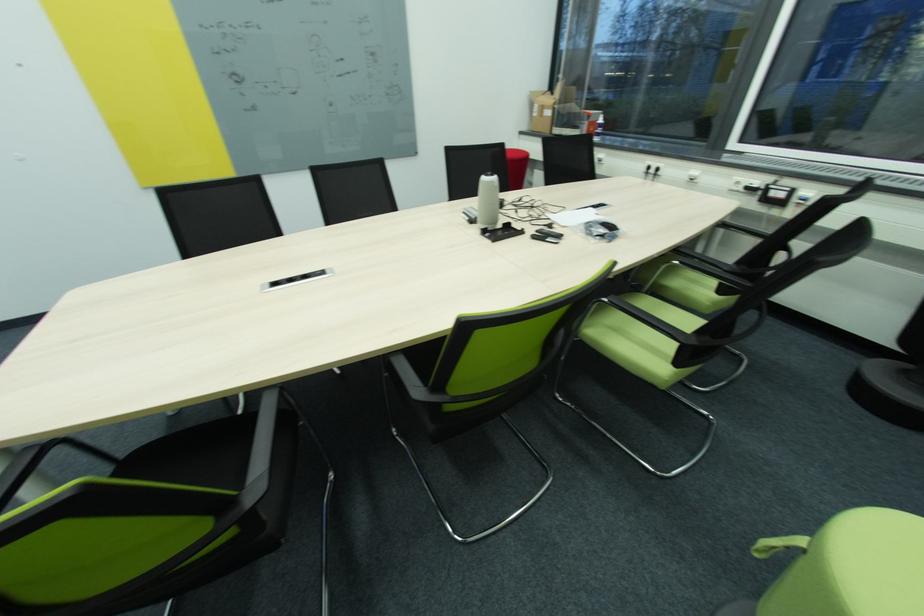
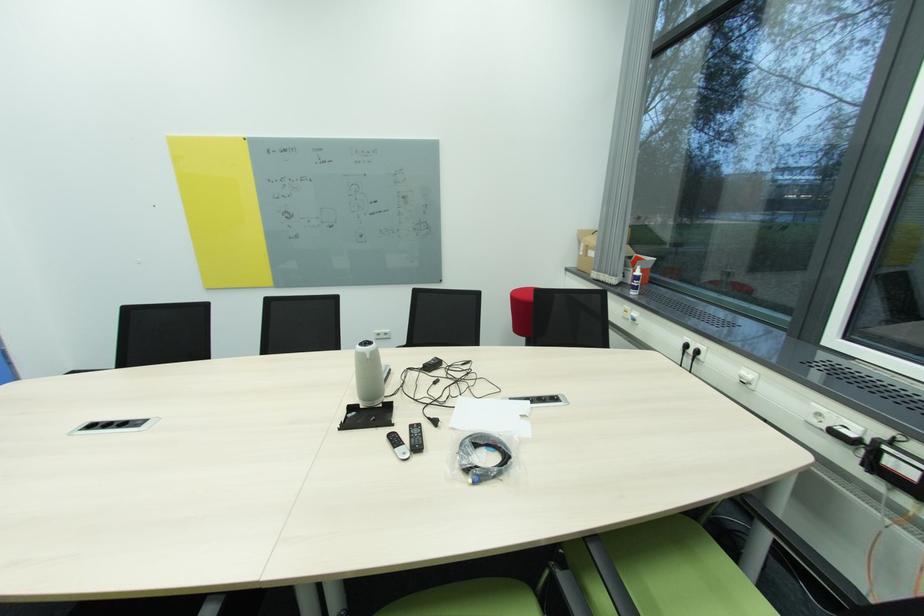
From the picture: In a continuous first-person perspective shot, in which direction is the camera moving?

The cameraman moved toward right, forward.